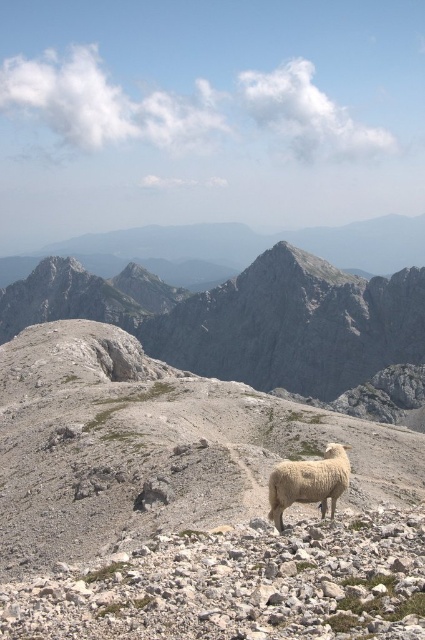
Question: Is gray rocky mountain at center closer to camera compared to white woolly sheep at center?

Choices:
 (A) no
 (B) yes

Answer: (A)

Question: Which of the following is the closest to the observer?

Choices:
 (A) gray rocky mountain at center
 (B) white woolly sheep at center

Answer: (B)

Question: Which point appears closest to the camera in this image?

Choices:
 (A) (275, 509)
 (B) (65, 296)

Answer: (A)

Question: Is gray rocky mountain at center in front of white woolly sheep at center?

Choices:
 (A) yes
 (B) no

Answer: (B)

Question: Does gray rocky mountain at center have a lesser width compared to white woolly sheep at center?

Choices:
 (A) no
 (B) yes

Answer: (A)

Question: Which point is closer to the camera?

Choices:
 (A) white woolly sheep at center
 (B) gray rocky mountain at center

Answer: (A)